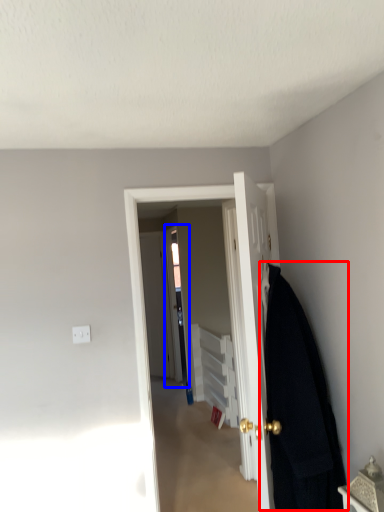
Question: Which object is closer to the camera taking this photo, blanket (highlighted by a red box) or screen door (highlighted by a blue box)?

Choices:
 (A) blanket
 (B) screen door

Answer: (A)